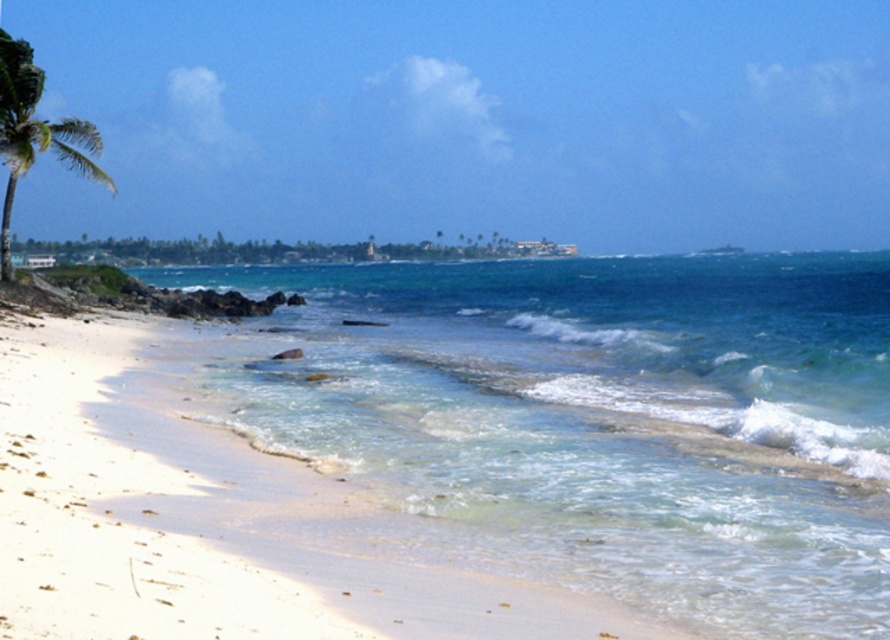
You are standing on the beach looking towards the ocean. There are two points marked on the sand. The first point is at coordinates point [859,381] and the second is at point [42,76]. Which point is closer to you?

Point [859,381] is in front of point [42,76], so the point closer to you is point [859,381].

You are standing on the beach and want to take a photo of both the clear blue water at center and the green leafy palm tree at left. Which object should you focus on first if you want both to be in sharp focus?

Since the clear blue water at center is closer to the viewer than the green leafy palm tree at left, you should focus on the green leafy palm tree at left first. This is because focusing on the farther object allows the closer object to still be within the depth of field, ensuring both are in focus.

You are standing on the beach and want to reach the clear blue water at center. According to the coordinates provided, in which direction should you walk from your current position at the palm tree on the left?

The clear blue water at center is located at coordinates point (600, 417). Since you are at the palm tree on the left, you should walk towards the right and slightly forward to reach the clear blue water at center.